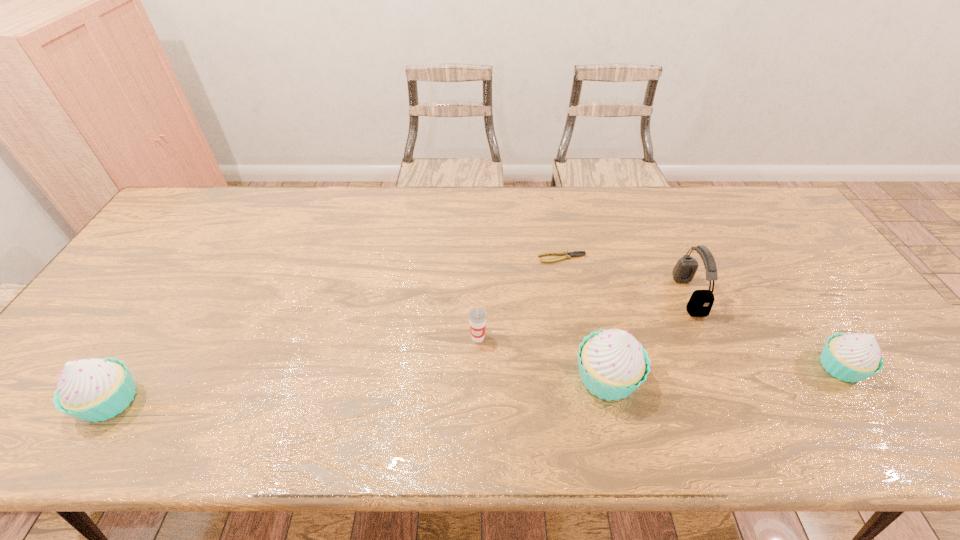
Locate an element on the screen. location for an additional cupcake to make spacing equal is located at coordinates (364, 389).